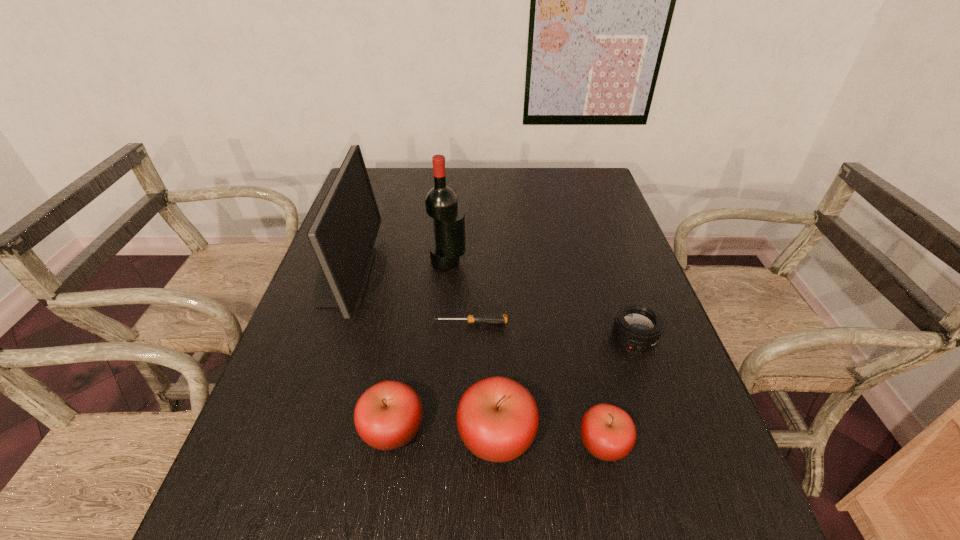
Where is `empty space that is in between the tallest apple and the wine bottle`? This screenshot has width=960, height=540. empty space that is in between the tallest apple and the wine bottle is located at coordinates (472, 349).

Find the location of a particular element. This screenshot has height=540, width=960. free space between the telephoto lens and the wine bottle is located at coordinates (540, 300).

Where is `vacant area that lies between the tallest apple and the wine bottle`? Image resolution: width=960 pixels, height=540 pixels. vacant area that lies between the tallest apple and the wine bottle is located at coordinates (472, 349).

Locate an element on the screen. The height and width of the screenshot is (540, 960). vacant space that is in between the second apple from left to right and the wine bottle is located at coordinates point(472,349).

At what (x,y) coordinates should I click in order to perform the action: click on free space between the second tallest apple and the tallest apple. Please return your answer as a coordinate pair (x, y). This screenshot has width=960, height=540. Looking at the image, I should click on (444, 434).

The width and height of the screenshot is (960, 540). I want to click on free spot between the screwdriver and the fourth tallest object, so click(432, 377).

You are a GUI agent. You are given a task and a screenshot of the screen. Output one action in this format:
    pyautogui.click(x=<x>, y=<y>)
    Task: Click on the free point between the wine bottle and the telephoto lens
    
    Given the screenshot: What is the action you would take?
    pyautogui.click(x=540, y=300)

Identify which object is the nearest to the shortest object. Please provide its 2D coordinates. Your answer should be formatted as a tuple, i.e. [(x, y)], where the tuple contains the x and y coordinates of a point satisfying the conditions above.

[(441, 203)]

Identify which object is located as the third nearest to the leftmost object. Please provide its 2D coordinates. Your answer should be formatted as a tuple, i.e. [(x, y)], where the tuple contains the x and y coordinates of a point satisfying the conditions above.

[(387, 416)]

Identify which apple is located as the second nearest to the second apple from right to left. Please provide its 2D coordinates. Your answer should be formatted as a tuple, i.e. [(x, y)], where the tuple contains the x and y coordinates of a point satisfying the conditions above.

[(608, 432)]